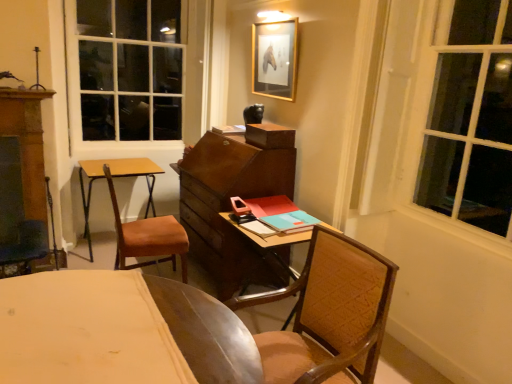
In order to face wooden round table at left, should I rotate leftwards or rightwards?

A 17.375 degree turn to the left will do.

Locate an element on the screen. Image resolution: width=512 pixels, height=384 pixels. wooden round table at left is located at coordinates [116, 177].

Image resolution: width=512 pixels, height=384 pixels. Describe the element at coordinates (271, 242) in the screenshot. I see `wooden desk at center` at that location.

This screenshot has height=384, width=512. What do you see at coordinates (148, 237) in the screenshot?
I see `brown leather chair at left, which appears as the 1th chair when viewed from the back` at bounding box center [148, 237].

This screenshot has height=384, width=512. I want to click on wooden round table at left, so click(116, 177).

Between wooden desk at center and brown leather chair at left, the 1th chair from the left, which one is positioned in front?

wooden desk at center is more forward.

Can you confirm if wooden desk at center is thinner than brown leather chair at left, the second chair in the right-to-left sequence?

No.

Image resolution: width=512 pixels, height=384 pixels. I want to click on chair located behind the wooden desk at center, so click(x=148, y=237).

Which object is further away from the camera taking this photo, wooden round table at left or brown wooden dresser at left?

wooden round table at left is further from the camera.

Who is bigger, wooden round table at left or brown wooden dresser at left?

wooden round table at left is bigger.

Is brown wooden dresser at left completely or partially inside wooden round table at left?

No.

How many degrees apart are the facing directions of wooden round table at left and brown woven chair at center, which is counted as the 1th chair, starting from the right?

They differ by 89.4 degrees in their facing directions.

From the image's perspective, is wooden round table at left below brown woven chair at center, which is counted as the 1th chair, starting from the right?

No.

Which point is more distant from viewer, (133, 168) or (373, 310)?

The point (133, 168) is more distant.

Can you confirm if wooden round table at left is smaller than brown woven chair at center, marked as the second chair in a left-to-right arrangement?

Indeed, wooden round table at left has a smaller size compared to brown woven chair at center, marked as the second chair in a left-to-right arrangement.

How much distance is there between brown wooden dresser at left and brown woven chair at center, which appears as the 2th chair when viewed from the back?

brown wooden dresser at left is 6.08 feet from brown woven chair at center, which appears as the 2th chair when viewed from the back.

Consider the image. Between brown wooden dresser at left and brown woven chair at center, which appears as the first chair when viewed from the front, which one has larger width?

brown woven chair at center, which appears as the first chair when viewed from the front.

Is brown wooden dresser at left at the right side of brown woven chair at center, which is counted as the 1th chair, starting from the right?

Incorrect, brown wooden dresser at left is not on the right side of brown woven chair at center, which is counted as the 1th chair, starting from the right.

From the image's perspective, which chair is the 2nd one below the brown wooden dresser at left? Please provide its 2D coordinates.

[(329, 315)]

This screenshot has width=512, height=384. I want to click on round table above the wooden desk at center (from the image's perspective), so click(116, 177).

Is wooden round table at left at the right side of wooden desk at center?

Incorrect, wooden round table at left is not on the right side of wooden desk at center.

Are wooden round table at left and wooden desk at center located far from each other?

Yes, wooden round table at left and wooden desk at center are located far from each other.

Which of these two, wooden round table at left or wooden desk at center, is wider?

wooden desk at center.

Is there a large distance between brown woven chair at center, marked as the second chair in a left-to-right arrangement, and gold-framed picture at upper center?

brown woven chair at center, marked as the second chair in a left-to-right arrangement, is positioned a significant distance from gold-framed picture at upper center.

From the picture: How many degrees apart are the facing directions of brown woven chair at center, which appears as the first chair when viewed from the front, and gold-framed picture at upper center?

2.83 degrees separate the facing orientations of brown woven chair at center, which appears as the first chair when viewed from the front, and gold-framed picture at upper center.

Is brown woven chair at center, which appears as the first chair when viewed from the front, not inside gold-framed picture at upper center?

brown woven chair at center, which appears as the first chair when viewed from the front, lies outside gold-framed picture at upper center's area.

Does brown woven chair at center, which is counted as the 1th chair, starting from the right, have a larger size compared to gold-framed picture at upper center?

Yes.

Is wooden desk at center surrounded by brown leather chair at left, the second chair in the right-to-left sequence?

No, wooden desk at center is not inside brown leather chair at left, the second chair in the right-to-left sequence.

Does brown leather chair at left, the second chair in the right-to-left sequence, come behind wooden desk at center?

Yes, brown leather chair at left, the second chair in the right-to-left sequence, is further from the viewer.

Which object is positioned more to the left, brown leather chair at left, the second chair in the right-to-left sequence, or wooden desk at center?

From the viewer's perspective, brown leather chair at left, the second chair in the right-to-left sequence, appears more on the left side.

Locate an element on the screen. The image size is (512, 384). table to the right of brown leather chair at left, the 1th chair from the left is located at coordinates (271, 242).

You are a GUI agent. You are given a task and a screenshot of the screen. Output one action in this format:
    pyautogui.click(x=<x>, y=<y>)
    Task: Click on the 1st chair positioned above the wooden desk at center (from a real-world perspective)
    This screenshot has height=384, width=512.
    Given the screenshot: What is the action you would take?
    pyautogui.click(x=148, y=237)

I want to click on dresser lying in front of the wooden round table at left, so click(23, 181).

When comparing their distances from wooden round table at left, does gold-framed picture at upper center or brown wooden dresser at left seem closer?

The object closer to wooden round table at left is brown wooden dresser at left.

When comparing their distances from brown wooden dresser at left, does brown leather chair at left, positioned as the 2th chair in front-to-back order, or wooden desk at center seem further?

Based on the image, wooden desk at center appears to be further to brown wooden dresser at left.

When comparing their distances from brown woven chair at center, marked as the second chair in a left-to-right arrangement, does wooden round table at left or gold-framed picture at upper center seem closer?

Among the two, gold-framed picture at upper center is located nearer to brown woven chair at center, marked as the second chair in a left-to-right arrangement.

From the image, which object appears to be farther from wooden desk at center, brown woven chair at center, which appears as the first chair when viewed from the front, or brown wooden dresser at left?

Among the two, brown wooden dresser at left is located further to wooden desk at center.

Which object lies further to the anchor point brown woven chair at center, which appears as the first chair when viewed from the front, gold-framed picture at upper center or brown wooden dresser at left?

brown wooden dresser at left is further to brown woven chair at center, which appears as the first chair when viewed from the front.

From the image, which object appears to be nearer to wooden desk at center, brown wooden dresser at left or gold-framed picture at upper center?

gold-framed picture at upper center lies closer to wooden desk at center than the other object.

Looking at the image, which one is located further to brown wooden dresser at left, wooden round table at left or brown leather chair at left, positioned as the 2th chair in front-to-back order?

wooden round table at left is positioned further to the anchor brown wooden dresser at left.

Based on their spatial positions, is brown leather chair at left, positioned as the 2th chair in front-to-back order, or wooden round table at left closer to brown woven chair at center, which appears as the first chair when viewed from the front?

The object closer to brown woven chair at center, which appears as the first chair when viewed from the front, is brown leather chair at left, positioned as the 2th chair in front-to-back order.

The image size is (512, 384). Find the location of `round table located between brown wooden dresser at left and wooden desk at center in the left-right direction`. round table located between brown wooden dresser at left and wooden desk at center in the left-right direction is located at coordinates (116, 177).

Image resolution: width=512 pixels, height=384 pixels. Identify the location of chair between gold-framed picture at upper center and wooden desk at center vertically. (148, 237).

Locate an element on the screen. Image resolution: width=512 pixels, height=384 pixels. chair between brown wooden dresser at left and gold-framed picture at upper center is located at coordinates (148, 237).

The height and width of the screenshot is (384, 512). Find the location of `chair between brown woven chair at center, marked as the second chair in a left-to-right arrangement, and gold-framed picture at upper center in the front-back direction`. chair between brown woven chair at center, marked as the second chair in a left-to-right arrangement, and gold-framed picture at upper center in the front-back direction is located at coordinates (148, 237).